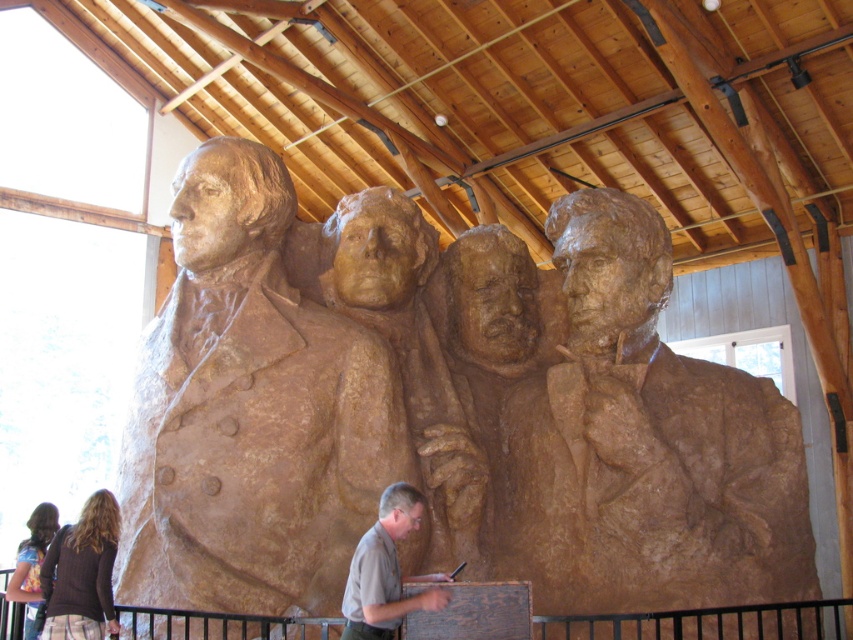
Question: Which of the following is the closest to the observer?

Choices:
 (A) brown textured uniform at center
 (B) brown textured bust at right
 (C) brown textured sculpture at left
 (D) brown textured sculpture at center

Answer: (A)

Question: Is brown textured sculpture at left below brown textured bust at right?

Choices:
 (A) yes
 (B) no

Answer: (B)

Question: Is brown sweater at lower left to the right of brown textured uniform at center from the viewer's perspective?

Choices:
 (A) no
 (B) yes

Answer: (A)

Question: Based on their relative distances, which object is farther from the brown textured sculpture at left?

Choices:
 (A) brown textured bust at right
 (B) brown textured uniform at center
 (C) brown textured sculpture at center

Answer: (A)

Question: Can you confirm if brown textured sculpture at left is positioned above brown textured bust at right?

Choices:
 (A) no
 (B) yes

Answer: (B)

Question: Which is nearer to the brown sweater at lower left?

Choices:
 (A) brown textured bust at right
 (B) brown textured uniform at center

Answer: (B)